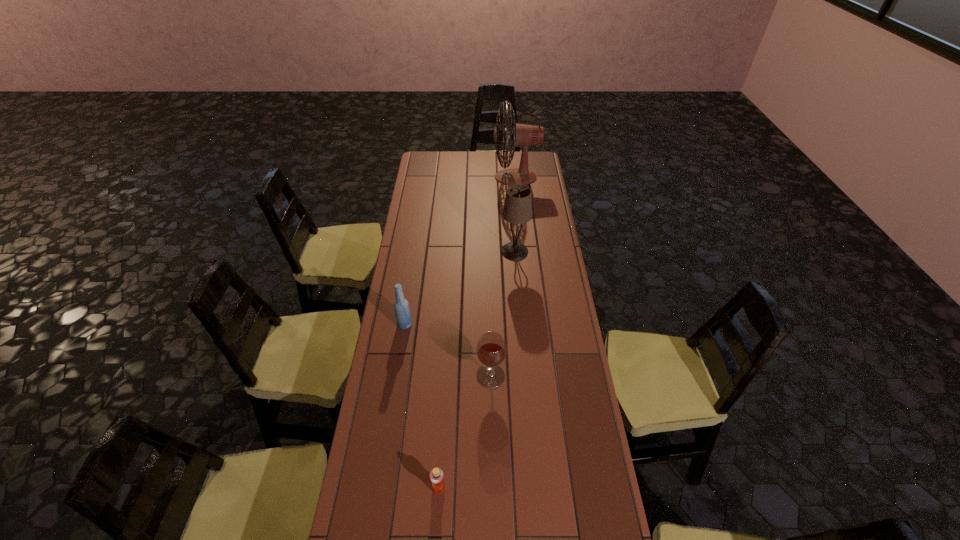
Locate an element on the screen. The height and width of the screenshot is (540, 960). fan is located at coordinates (521, 135).

Find the location of a particular element. The width and height of the screenshot is (960, 540). the tallest object is located at coordinates (521, 135).

I want to click on lampshade, so click(x=517, y=209).

Locate an element on the screen. The image size is (960, 540). the second tallest object is located at coordinates (517, 209).

The height and width of the screenshot is (540, 960). What are the coordinates of `the leftmost object` in the screenshot? It's located at tap(402, 312).

I want to click on the third farthest object, so click(402, 312).

Where is `wineglass`? Image resolution: width=960 pixels, height=540 pixels. wineglass is located at coordinates (491, 349).

Identify the location of orange juice. The image size is (960, 540). (436, 475).

This screenshot has width=960, height=540. What are the coordinates of `the nearest object` in the screenshot? It's located at (436, 475).

Find the location of a particular element. free location located in front of the fan to direct airflow is located at coordinates (446, 177).